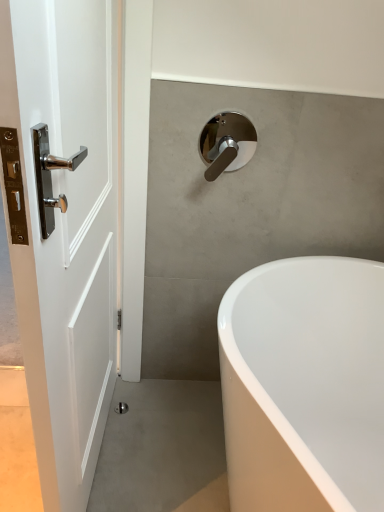
Question: From the image's perspective, is white glossy door at left located beneath white glossy bathtub at lower right?

Choices:
 (A) no
 (B) yes

Answer: (A)

Question: Is white glossy door at left looking in the opposite direction of white glossy bathtub at lower right?

Choices:
 (A) no
 (B) yes

Answer: (B)

Question: Is white glossy door at left in contact with white glossy bathtub at lower right?

Choices:
 (A) no
 (B) yes

Answer: (A)

Question: From a real-world perspective, is white glossy door at left on white glossy bathtub at lower right?

Choices:
 (A) no
 (B) yes

Answer: (B)

Question: Is white glossy door at left positioned before white glossy bathtub at lower right?

Choices:
 (A) no
 (B) yes

Answer: (B)

Question: Looking at their shapes, would you say white glossy bathtub at lower right is wider or thinner than chrome metallic tap at upper center?

Choices:
 (A) wide
 (B) thin

Answer: (A)

Question: From the image's perspective, is white glossy bathtub at lower right above or below chrome metallic tap at upper center?

Choices:
 (A) below
 (B) above

Answer: (A)

Question: Is white glossy bathtub at lower right to the left or to the right of chrome metallic tap at upper center in the image?

Choices:
 (A) left
 (B) right

Answer: (B)

Question: Is white glossy bathtub at lower right in front of or behind chrome metallic tap at upper center in the image?

Choices:
 (A) behind
 (B) front

Answer: (B)

Question: Considering the positions of chrome metallic tap at upper center and white glossy door at left in the image, is chrome metallic tap at upper center bigger or smaller than white glossy door at left?

Choices:
 (A) small
 (B) big

Answer: (A)

Question: From a real-world perspective, is chrome metallic tap at upper center positioned above or below white glossy door at left?

Choices:
 (A) below
 (B) above

Answer: (B)

Question: Visually, is chrome metallic tap at upper center positioned to the left or to the right of white glossy door at left?

Choices:
 (A) right
 (B) left

Answer: (A)

Question: Is chrome metallic tap at upper center taller or shorter than white glossy door at left?

Choices:
 (A) tall
 (B) short

Answer: (B)

Question: Considering the positions of point (243, 324) and point (51, 265), is point (243, 324) closer or farther from the camera than point (51, 265)?

Choices:
 (A) farther
 (B) closer

Answer: (A)

Question: Relative to white glossy door at left, is white glossy bathtub at lower right in front or behind?

Choices:
 (A) front
 (B) behind

Answer: (B)